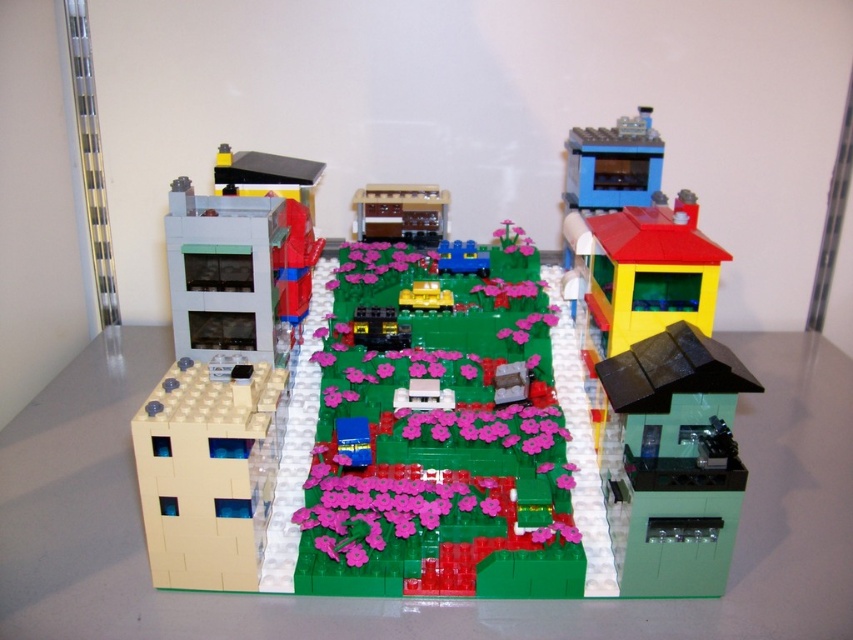
You are a visitor looking at the LEGO town from above. You see the beige matte building at lower left and the blue plastic train at center. Which object is closer to the edge of the table?

The beige matte building at lower left is closer to the edge of the table because it is positioned under the blue plastic train at center, meaning it is further out towards the edge compared to the train which is centrally placed.

You are a toy car collector looking at the LEGO town scene. You notice the smooth gray building at upper left and the yellow plastic car at center. Which object would require more space to display separately?

The smooth gray building at upper left is larger in size than the yellow plastic car at center, so it would require more space to display separately.

You are looking at the LEGO town from above. The beige matte building at lower left is located at point A. Where is point A? Choose from the coordinates below. 1. Lower left corner 2. Center of the image 3. Upper right corner

The beige matte building at lower left is located at point A which is the lower left corner.